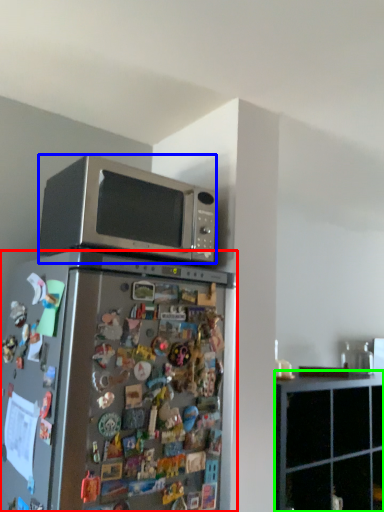
Question: Which object is positioned farthest from refrigerator (highlighted by a red box)? Select from microwave oven (highlighted by a blue box) and cabinetry (highlighted by a green box).

Choices:
 (A) microwave oven
 (B) cabinetry

Answer: (B)